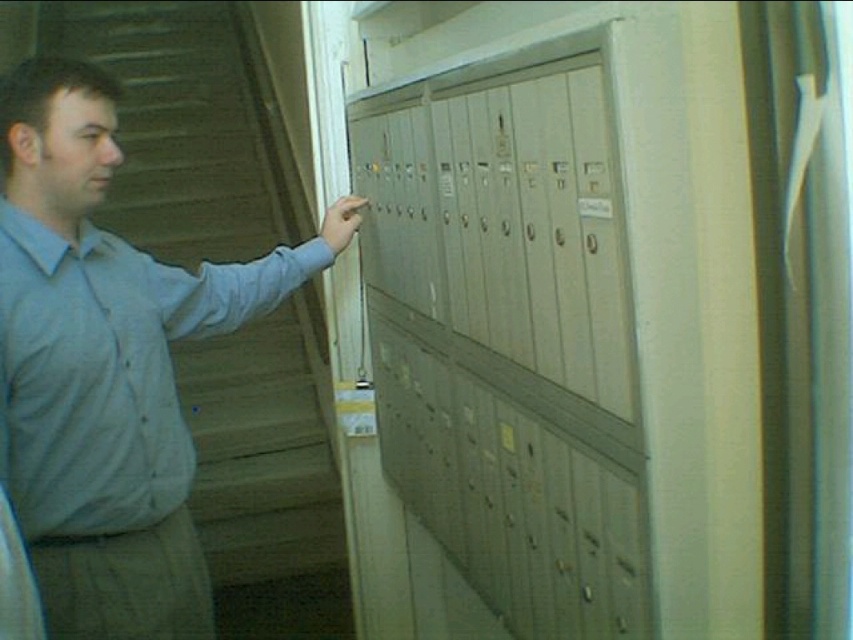
Question: Does metallic gray locker at center have a greater width compared to light blue shirt at left?

Choices:
 (A) yes
 (B) no

Answer: (B)

Question: Which point is closer to the camera?

Choices:
 (A) (181, 570)
 (B) (567, 324)

Answer: (B)

Question: Which object is closer to the camera taking this photo?

Choices:
 (A) metallic gray locker at center
 (B) light blue shirt at left

Answer: (A)

Question: Which point appears closest to the camera in this image?

Choices:
 (A) (283, 275)
 (B) (631, 492)

Answer: (B)

Question: In this image, where is metallic gray locker at center located relative to light blue shirt at left?

Choices:
 (A) left
 (B) right

Answer: (B)

Question: Does metallic gray locker at center appear on the right side of light blue shirt at left?

Choices:
 (A) no
 (B) yes

Answer: (B)